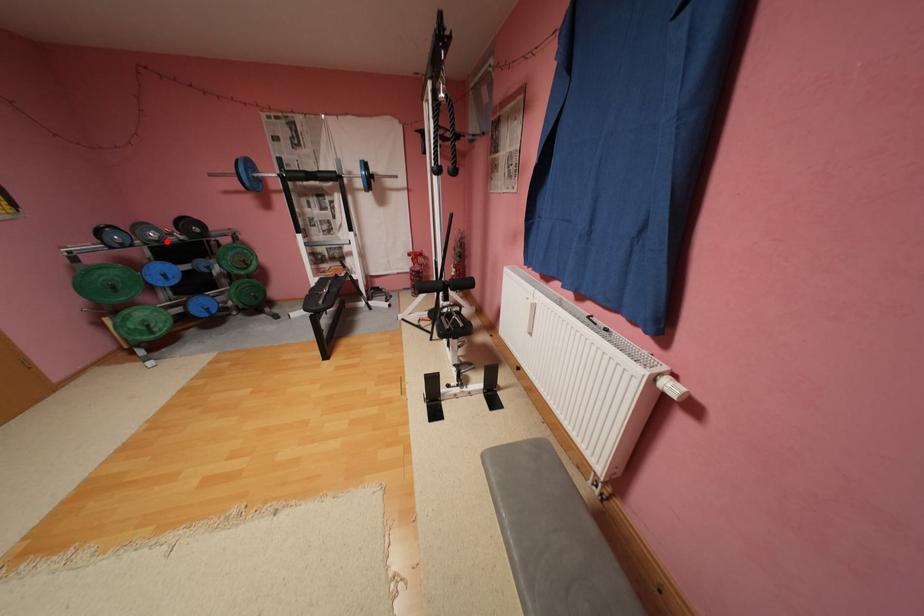
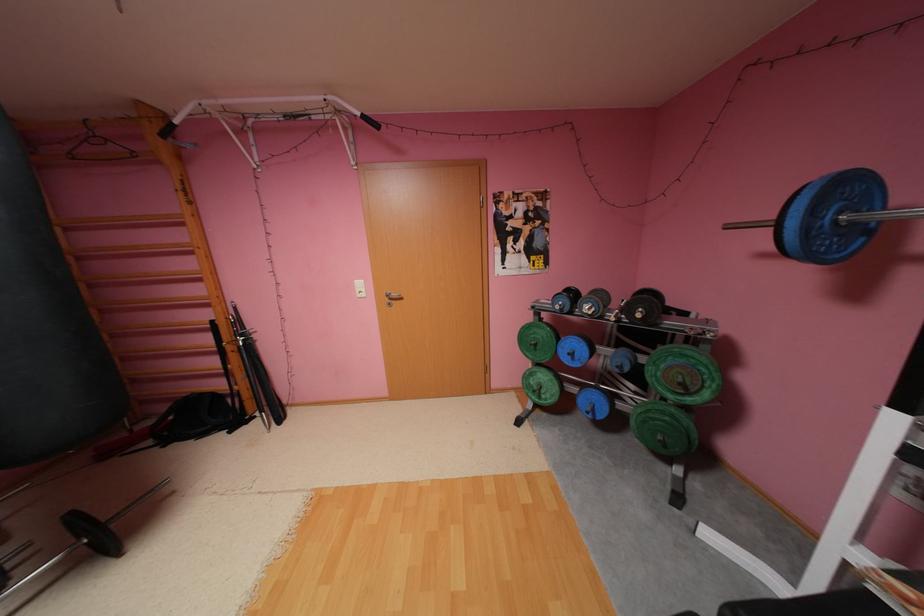
Question: I am providing you with two images of the same scene from different viewpoints. A red point is marked on the first image. Is the red point's position out of view in image 2?

Choices:
 (A) Yes
 (B) No

Answer: (B)